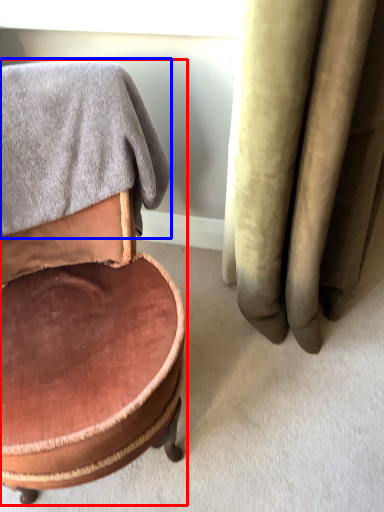
Question: Which of the following is the farthest to the observer, chair (highlighted by a red box) or bath towel (highlighted by a blue box)?

Choices:
 (A) chair
 (B) bath towel

Answer: (B)